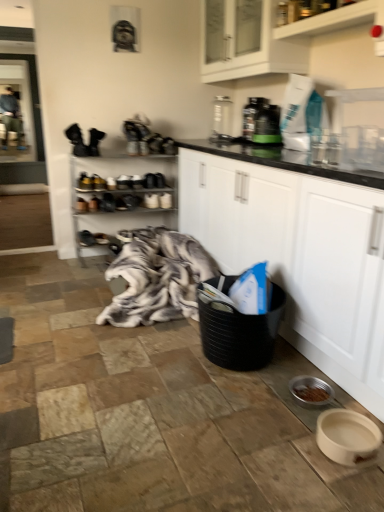
Question: From a real-world perspective, is metallic silver shoe rack at center, which appears as the 1th shelf when ordered from the bottom, over metallic gray coffee maker at upper center, arranged as the 2th appliance when viewed from the right?

Choices:
 (A) no
 (B) yes

Answer: (A)

Question: Is metallic silver shoe rack at center, which appears as the 1th shelf when ordered from the bottom, positioned beyond the bounds of metallic gray coffee maker at upper center, acting as the 1th appliance starting from the back?

Choices:
 (A) yes
 (B) no

Answer: (A)

Question: Considering the relative positions of metallic silver shoe rack at center, positioned as the second shelf in top-to-bottom order, and metallic gray coffee maker at upper center, the first appliance in the left-to-right sequence, in the image provided, is metallic silver shoe rack at center, positioned as the second shelf in top-to-bottom order, to the left of metallic gray coffee maker at upper center, the first appliance in the left-to-right sequence, from the viewer's perspective?

Choices:
 (A) no
 (B) yes

Answer: (B)

Question: Considering the relative sizes of metallic silver shoe rack at center, which is the first shelf from back to front, and metallic gray coffee maker at upper center, the first appliance in the left-to-right sequence, in the image provided, is metallic silver shoe rack at center, which is the first shelf from back to front, bigger than metallic gray coffee maker at upper center, the first appliance in the left-to-right sequence,?

Choices:
 (A) no
 (B) yes

Answer: (B)

Question: Can you confirm if metallic silver shoe rack at center, placed as the 2th shelf when sorted from front to back, is thinner than metallic gray coffee maker at upper center, marked as the 2th appliance in a front-to-back arrangement?

Choices:
 (A) yes
 (B) no

Answer: (B)

Question: Considering the relative sizes of metallic silver shoe rack at center, which appears as the 1th shelf when ordered from the bottom, and metallic gray coffee maker at upper center, the first appliance in the left-to-right sequence, in the image provided, is metallic silver shoe rack at center, which appears as the 1th shelf when ordered from the bottom, taller than metallic gray coffee maker at upper center, the first appliance in the left-to-right sequence,?

Choices:
 (A) no
 (B) yes

Answer: (B)

Question: Is metallic gray coffee maker at upper center, marked as the 2th appliance in a front-to-back arrangement, closer to the viewer compared to fluffy gray blanket at center?

Choices:
 (A) yes
 (B) no

Answer: (B)

Question: Is metallic gray coffee maker at upper center, arranged as the 2th appliance when viewed from the right, thinner than fluffy gray blanket at center?

Choices:
 (A) no
 (B) yes

Answer: (B)

Question: Is metallic gray coffee maker at upper center, marked as the 2th appliance in a front-to-back arrangement, not near fluffy gray blanket at center?

Choices:
 (A) no
 (B) yes

Answer: (B)

Question: Considering the relative positions of metallic gray coffee maker at upper center, arranged as the 2th appliance when viewed from the right, and fluffy gray blanket at center in the image provided, is metallic gray coffee maker at upper center, arranged as the 2th appliance when viewed from the right, to the right of fluffy gray blanket at center from the viewer's perspective?

Choices:
 (A) no
 (B) yes

Answer: (B)

Question: Can you confirm if metallic gray coffee maker at upper center, arranged as the 2th appliance when viewed from the right, is shorter than fluffy gray blanket at center?

Choices:
 (A) no
 (B) yes

Answer: (A)

Question: From the image's perspective, is metallic gray coffee maker at upper center, acting as the 1th appliance starting from the back, beneath fluffy gray blanket at center?

Choices:
 (A) yes
 (B) no

Answer: (B)

Question: Is green plastic bottle at upper center, arranged as the 2th appliance when viewed from the left, bigger than clear glass screen door at upper left?

Choices:
 (A) yes
 (B) no

Answer: (B)